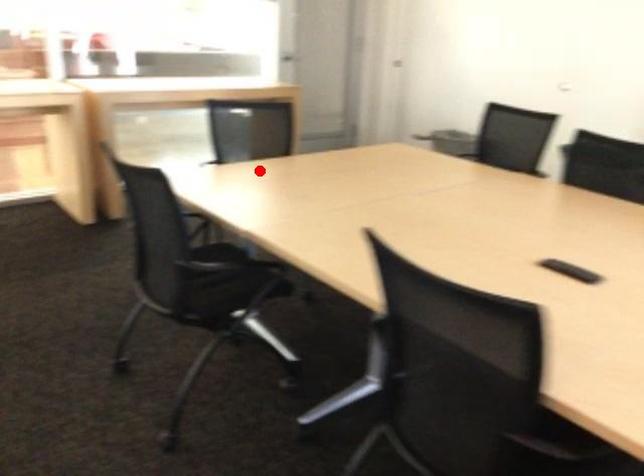
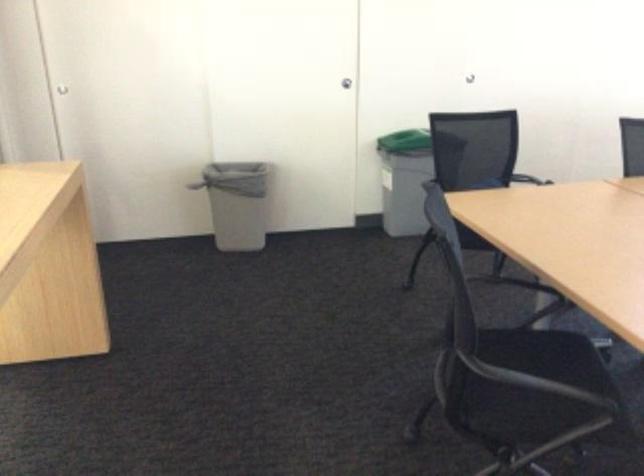
Question: I am providing you with two images of the same scene from different viewpoints. In image1, a red point is highlighted. Considering the same 3D point in image2, which of the following is correct?

Choices:
 (A) It is closer
 (B) It is farther

Answer: (A)